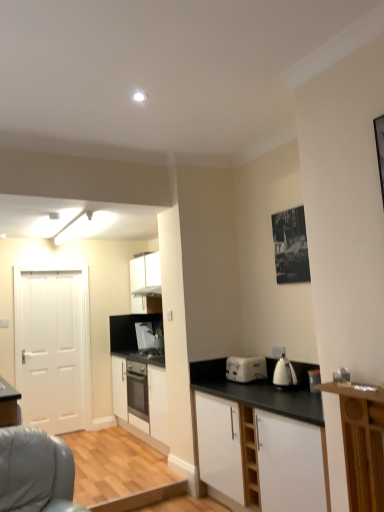
This screenshot has width=384, height=512. Describe the element at coordinates (246, 368) in the screenshot. I see `white plastic toaster at center, positioned as the 2th kitchen appliance in right-to-left order` at that location.

What do you see at coordinates (290, 246) in the screenshot?
I see `black paper poster at upper right` at bounding box center [290, 246].

Locate an element on the screen. This screenshot has width=384, height=512. black paper poster at upper right is located at coordinates (290, 246).

This screenshot has height=512, width=384. What do you see at coordinates (149, 355) in the screenshot?
I see `black matte sink at center` at bounding box center [149, 355].

Find the location of `white matte cabinet at center, which is counted as the first cabinetry, starting from the back`. white matte cabinet at center, which is counted as the first cabinetry, starting from the back is located at coordinates (148, 400).

The height and width of the screenshot is (512, 384). What do you see at coordinates (144, 335) in the screenshot?
I see `matte black microwave at center, which is the first kitchen appliance in back-to-front order` at bounding box center [144, 335].

At what (x,y) coordinates should I click in order to perform the action: click on white plastic toaster at center, the second kitchen appliance from the front. Please return your answer as a coordinate pair (x, y). This screenshot has width=384, height=512. Looking at the image, I should click on (246, 368).

Is white matte cabinet at lower right, marked as the 1th cabinetry in a front-to-back arrangement, to the left of white glossy electric kettle at right, which appears as the 3th kitchen appliance when viewed from the back, from the viewer's perspective?

Yes.

From the image's perspective, is white matte cabinet at lower right, marked as the 1th cabinetry in a front-to-back arrangement, located beneath white glossy electric kettle at right, positioned as the first kitchen appliance in right-to-left order?

Yes, from the image's perspective, white matte cabinet at lower right, marked as the 1th cabinetry in a front-to-back arrangement, is below white glossy electric kettle at right, positioned as the first kitchen appliance in right-to-left order.

How different are the orientations of white matte cabinet at lower right, marked as the 1th cabinetry in a front-to-back arrangement, and white glossy electric kettle at right, which is counted as the first kitchen appliance, starting from the front, in degrees?

The facing directions of white matte cabinet at lower right, marked as the 1th cabinetry in a front-to-back arrangement, and white glossy electric kettle at right, which is counted as the first kitchen appliance, starting from the front, are 2.07 degrees apart.

Starting from the white glossy electric kettle at right, the third kitchen appliance in the left-to-right sequence, which cabinetry is the 1st one behind? Please provide its 2D coordinates.

[(145, 283)]

From the image's perspective, is white matte cabinet at center, the 2th cabinetry positioned from the front, under white glossy electric kettle at right, the third kitchen appliance in the left-to-right sequence?

Actually, white matte cabinet at center, the 2th cabinetry positioned from the front, appears above white glossy electric kettle at right, the third kitchen appliance in the left-to-right sequence, in the image.

How different are the orientations of white matte cabinet at center, the 2th cabinetry positioned from the front, and white glossy electric kettle at right, which is counted as the first kitchen appliance, starting from the front, in degrees?

1.1 degrees separate the facing orientations of white matte cabinet at center, the 2th cabinetry positioned from the front, and white glossy electric kettle at right, which is counted as the first kitchen appliance, starting from the front.

Considering the sizes of objects white matte cabinet at center, marked as the 2th cabinetry in a back-to-front arrangement, and white glossy electric kettle at right, which is counted as the first kitchen appliance, starting from the front, in the image provided, who is smaller, white matte cabinet at center, marked as the 2th cabinetry in a back-to-front arrangement, or white glossy electric kettle at right, which is counted as the first kitchen appliance, starting from the front,?

white glossy electric kettle at right, which is counted as the first kitchen appliance, starting from the front.

Does white matte cabinet at center, the 2th cabinetry positioned from the front, appear on the left side of white matte door at left?

No.

Locate an element on the screen. door below the white matte cabinet at center, marked as the 2th cabinetry in a back-to-front arrangement (from a real-world perspective) is located at coordinates (53, 348).

Which object is closer to the camera taking this photo, white matte cabinet at center, marked as the 2th cabinetry in a back-to-front arrangement, or white matte door at left?

white matte cabinet at center, marked as the 2th cabinetry in a back-to-front arrangement.

Considering the sizes of objects black matte sink at center and white matte cabinet at center, acting as the 3th cabinetry starting from the front, in the image provided, who is bigger, black matte sink at center or white matte cabinet at center, acting as the 3th cabinetry starting from the front,?

Bigger between the two is white matte cabinet at center, acting as the 3th cabinetry starting from the front.

Is white matte cabinet at center, acting as the 3th cabinetry starting from the front, completely or partially inside black matte sink at center?

No, white matte cabinet at center, acting as the 3th cabinetry starting from the front, is not inside black matte sink at center.

Which is farther, [152,359] or [155,395]?

The point [152,359] is more distant.

Considering the relative sizes of white matte door at left and white matte cabinet at center, which is counted as the first cabinetry, starting from the back, in the image provided, is white matte door at left thinner than white matte cabinet at center, which is counted as the first cabinetry, starting from the back,?

Correct, the width of white matte door at left is less than that of white matte cabinet at center, which is counted as the first cabinetry, starting from the back.

Measure the distance from white matte door at left to white matte cabinet at center, acting as the 3th cabinetry starting from the front.

white matte door at left and white matte cabinet at center, acting as the 3th cabinetry starting from the front, are 1.54 meters apart from each other.

Between white matte door at left and white matte cabinet at center, which is counted as the first cabinetry, starting from the back, which one is positioned in front?

white matte door at left.

Looking at this image, how different are the orientations of white matte door at left and white matte cabinet at center, acting as the 3th cabinetry starting from the front, in degrees?

The facing directions of white matte door at left and white matte cabinet at center, acting as the 3th cabinetry starting from the front, are 90.8 degrees apart.

From a real-world perspective, is white matte door at left physically located above or below black matte sink at center?

white matte door at left is above black matte sink at center.

Does point (66, 329) appear closer or farther from the camera than point (152, 353)?

Point (66, 329) is positioned farther from the camera compared to point (152, 353).

Considering the relative positions of white matte door at left and black matte sink at center in the image provided, is white matte door at left to the left of black matte sink at center from the viewer's perspective?

Yes, white matte door at left is to the left of black matte sink at center.

Measure the distance from white matte door at left to black matte sink at center.

white matte door at left is 3.90 feet away from black matte sink at center.

Considering the relative sizes of white plastic toaster at center, positioned as the 2th kitchen appliance in right-to-left order, and white matte cabinet at center, which is counted as the first cabinetry, starting from the back, in the image provided, is white plastic toaster at center, positioned as the 2th kitchen appliance in right-to-left order, wider than white matte cabinet at center, which is counted as the first cabinetry, starting from the back,?

No.

At what (x,y) coordinates should I click in order to perform the action: click on cabinetry that is the 2nd object located behind the white plastic toaster at center, the second kitchen appliance from the front. Please return your answer as a coordinate pair (x, y). The height and width of the screenshot is (512, 384). Looking at the image, I should click on (148, 400).

Is there a large distance between white plastic toaster at center, which is the 2th kitchen appliance in back-to-front order, and white matte cabinet at center, which is counted as the first cabinetry, starting from the back?

Actually, white plastic toaster at center, which is the 2th kitchen appliance in back-to-front order, and white matte cabinet at center, which is counted as the first cabinetry, starting from the back, are a little close together.

Where is `cabinetry in front of the white glossy electric kettle at right, positioned as the first kitchen appliance in right-to-left order`? The image size is (384, 512). cabinetry in front of the white glossy electric kettle at right, positioned as the first kitchen appliance in right-to-left order is located at coordinates (261, 442).

The image size is (384, 512). I want to click on cabinetry above the white glossy electric kettle at right, positioned as the first kitchen appliance in right-to-left order (from the image's perspective), so click(145, 283).

Looking at the image, which one is located closer to black matte sink at center, white matte cabinet at lower right, marked as the 1th cabinetry in a front-to-back arrangement, or white matte door at left?

The object closer to black matte sink at center is white matte door at left.

Based on their spatial positions, is white glossy electric kettle at right, positioned as the first kitchen appliance in right-to-left order, or black paper poster at upper right further from black matte sink at center?

black paper poster at upper right.

When comparing their distances from black paper poster at upper right, does matte black microwave at center, which is the first kitchen appliance in back-to-front order, or white glossy electric kettle at right, positioned as the first kitchen appliance in right-to-left order, seem closer?

white glossy electric kettle at right, positioned as the first kitchen appliance in right-to-left order, lies closer to black paper poster at upper right than the other object.

Considering their positions, is white glossy electric kettle at right, which appears as the 3th kitchen appliance when viewed from the back, positioned further to matte black microwave at center, which is the third kitchen appliance from front to back, than white plastic toaster at center?

The object further to matte black microwave at center, which is the third kitchen appliance from front to back, is white plastic toaster at center.

Which object lies further to the anchor point white glossy electric kettle at right, the third kitchen appliance in the left-to-right sequence, black matte sink at center or white matte cabinet at center, acting as the 3th cabinetry starting from the front?

Among the two, black matte sink at center is located further to white glossy electric kettle at right, the third kitchen appliance in the left-to-right sequence.

From the image, which object appears to be nearer to white matte cabinet at center, the 2th cabinetry positioned from the front, white matte cabinet at lower right, the third cabinetry in the back-to-front sequence, or black paper poster at upper right?

black paper poster at upper right is positioned closer to the anchor white matte cabinet at center, the 2th cabinetry positioned from the front.

When comparing their distances from matte black microwave at center, the third kitchen appliance when ordered from right to left, does black paper poster at upper right or white plastic toaster at center seem further?

Based on the image, white plastic toaster at center appears to be further to matte black microwave at center, the third kitchen appliance when ordered from right to left.

Considering their positions, is white matte cabinet at center, acting as the 3th cabinetry starting from the front, positioned further to black matte sink at center than matte black microwave at center, the third kitchen appliance when ordered from right to left?

white matte cabinet at center, acting as the 3th cabinetry starting from the front, lies further to black matte sink at center than the other object.

Find the location of a particular element. The image size is (384, 512). sink located between white glossy electric kettle at right, which appears as the 3th kitchen appliance when viewed from the back, and white matte cabinet at center, marked as the 2th cabinetry in a back-to-front arrangement, in the depth direction is located at coordinates (149, 355).

The width and height of the screenshot is (384, 512). Find the location of `sink located between white matte door at left and black paper poster at upper right in the left-right direction`. sink located between white matte door at left and black paper poster at upper right in the left-right direction is located at coordinates (149, 355).

Find the location of a particular element. kitchen appliance between white matte cabinet at lower right, the third cabinetry in the back-to-front sequence, and white plastic toaster at center, which is the 2th kitchen appliance in left-to-right order, in the front-back direction is located at coordinates (284, 373).

Where is `sink between white matte door at left and white glossy electric kettle at right, which appears as the 3th kitchen appliance when viewed from the back, from left to right`? sink between white matte door at left and white glossy electric kettle at right, which appears as the 3th kitchen appliance when viewed from the back, from left to right is located at coordinates click(149, 355).